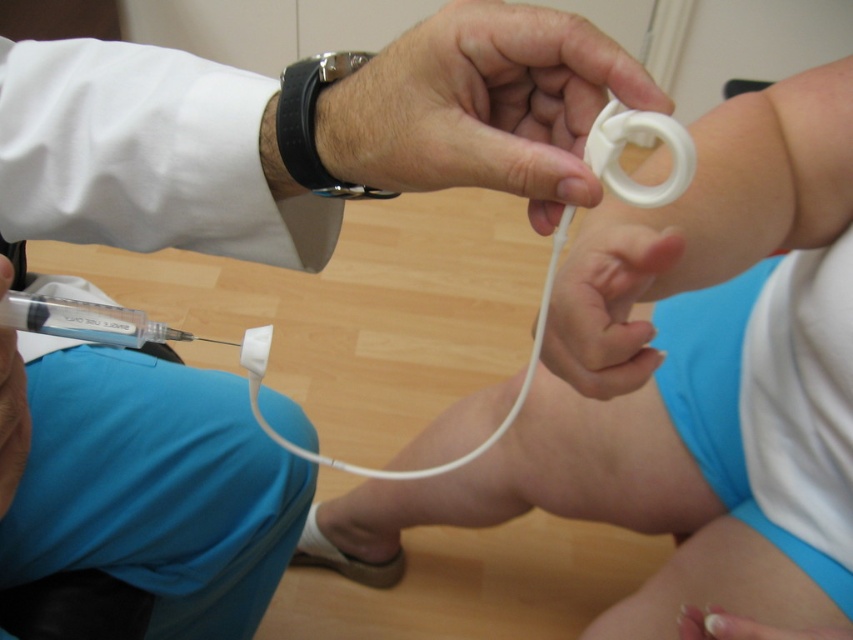
Question: Considering the real-world distances, which object is farthest from the white matte cord at lower center?

Choices:
 (A) white plastic ring at upper center
 (B) transparent plastic syringe at lower left
 (C) white matte fingernail at lower center
 (D) white matte ring at upper center

Answer: (A)

Question: Which object appears closest to the camera in this image?

Choices:
 (A) transparent plastic syringe at lower left
 (B) white matte ring at upper center
 (C) matte white syringe at lower left

Answer: (C)

Question: Among these objects, which one is nearest to the camera?

Choices:
 (A) white matte ring at upper center
 (B) white matte cord at lower center
 (C) transparent plastic syringe at lower left
 (D) matte white syringe at lower left

Answer: (D)

Question: Where is white plastic ring at upper center located in relation to matte white syringe at lower left in the image?

Choices:
 (A) below
 (B) above

Answer: (A)

Question: Does white plastic ring at upper center appear on the right side of white matte ring at upper center?

Choices:
 (A) yes
 (B) no

Answer: (A)

Question: Is white matte ring at upper center smaller than white matte cord at lower center?

Choices:
 (A) yes
 (B) no

Answer: (A)